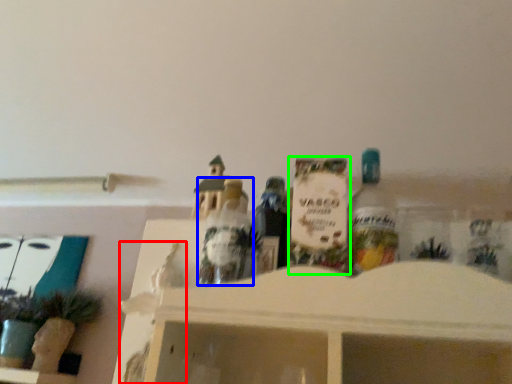
Question: Which is nearer to the toy (highlighted by a red box)? toy (highlighted by a blue box) or toy (highlighted by a green box).

Choices:
 (A) toy
 (B) toy

Answer: (A)